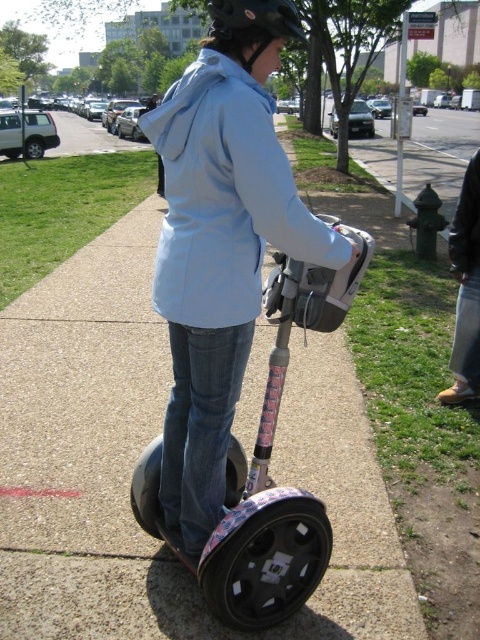
Who is lower down, light blue fabric sweatshirt at center or brown leather shoes at lower right?

brown leather shoes at lower right is below.

Is point (288, 182) closer to viewer compared to point (479, 374)?

That is True.

I want to click on light blue fabric sweatshirt at center, so click(x=226, y=196).

Find the location of a particular element. This screenshot has height=640, width=480. light blue fabric sweatshirt at center is located at coordinates (226, 196).

Who is taller, metallic pink scooter at center or black matte helmet at upper center?

Standing taller between the two is metallic pink scooter at center.

Does metallic pink scooter at center appear on the left side of black matte helmet at upper center?

No, metallic pink scooter at center is not to the left of black matte helmet at upper center.

Is point (302, 304) positioned behind point (282, 13)?

Yes, point (302, 304) is behind point (282, 13).

Identify the location of metallic pink scooter at center. (268, 461).

Does light blue fabric sweatshirt at center have a lesser width compared to black matte helmet at upper center?

No, light blue fabric sweatshirt at center is not thinner than black matte helmet at upper center.

Which is behind, point (195, 68) or point (262, 3)?

Point (195, 68)

In the scene shown: Who is more distant from viewer, (236, 164) or (213, 10)?

Positioned behind is point (213, 10).

In order to click on light blue fabric sweatshirt at center in this screenshot , I will do `click(226, 196)`.